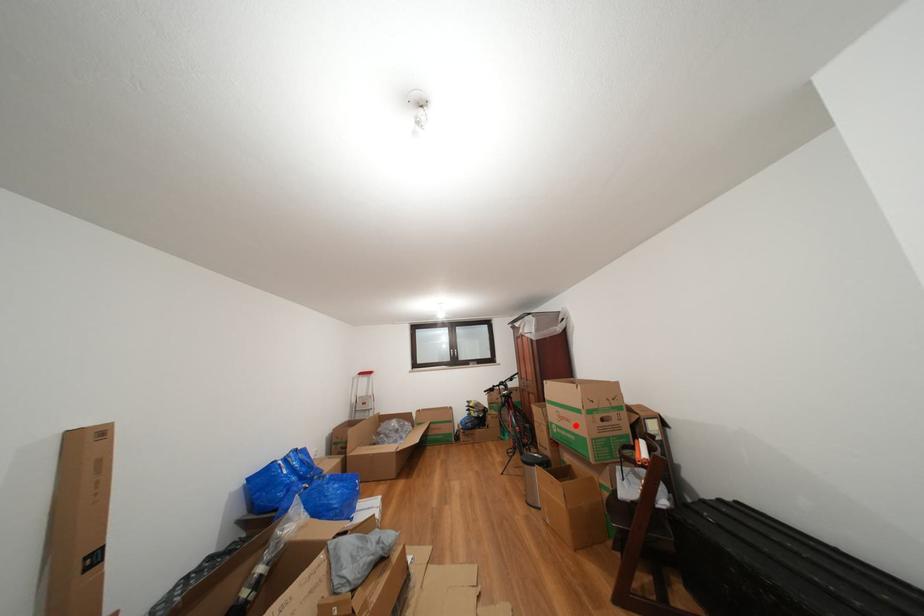
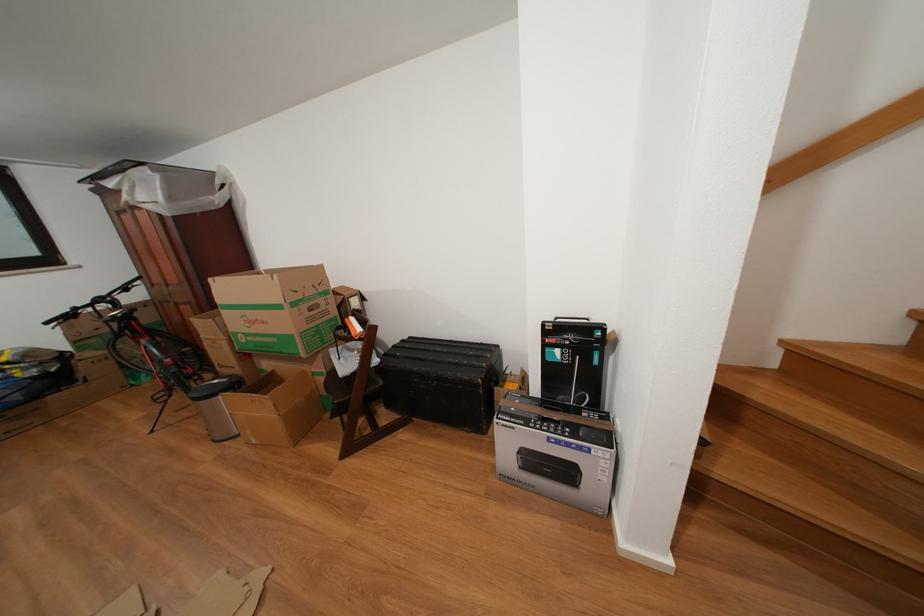
Where in the second image is the point corresponding to the highlighted location from the first image?

(272, 328)